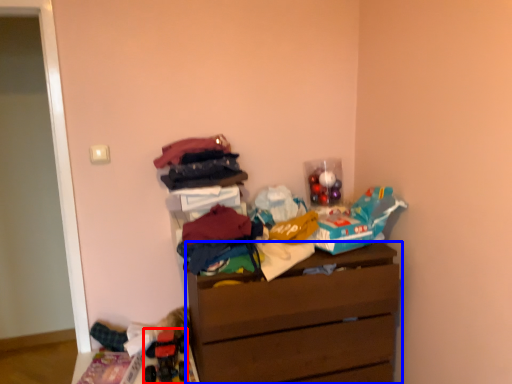
Question: Which of the following is the closest to the observer, toy (highlighted by a red box) or chest of drawers (highlighted by a blue box)?

Choices:
 (A) toy
 (B) chest of drawers

Answer: (B)